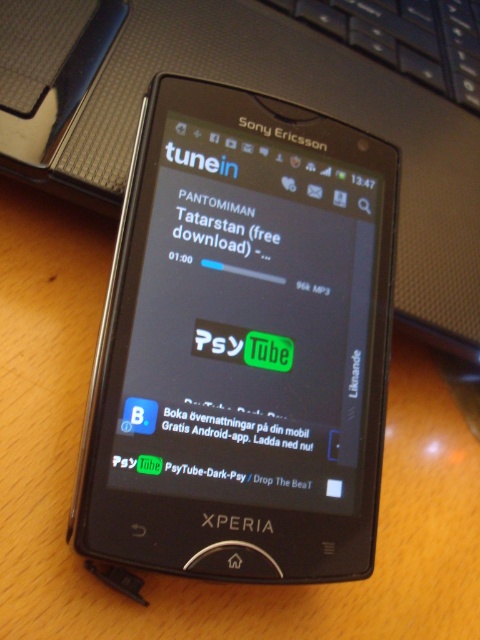
Which of these two, matte black screen at center or white matte text at center, stands taller?

With more height is matte black screen at center.

Does matte black screen at center have a smaller size compared to white matte text at center?

No, matte black screen at center is not smaller than white matte text at center.

Is point (171, 131) farther from viewer compared to point (219, 230)?

No, it is not.

Locate an element on the screen. The height and width of the screenshot is (640, 480). matte black screen at center is located at coordinates (249, 323).